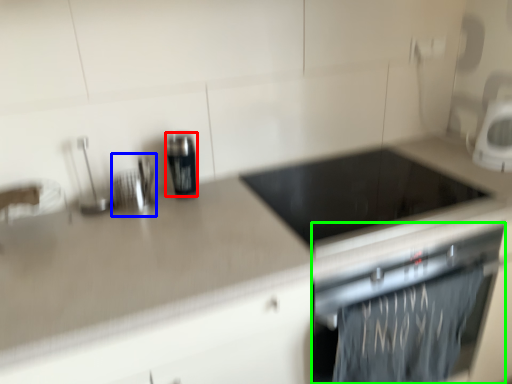
Question: Which object is the closest to the kitchen appliance (highlighted by a red box)? Choose among these: appliance (highlighted by a blue box) or home appliance (highlighted by a green box).

Choices:
 (A) appliance
 (B) home appliance

Answer: (A)